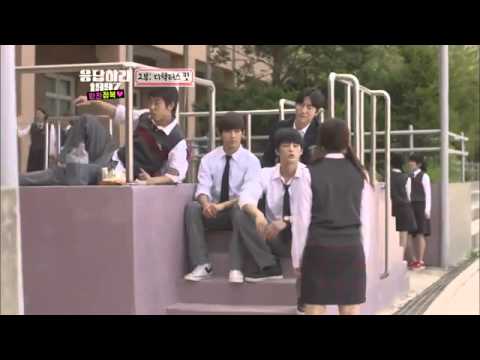
Image resolution: width=480 pixels, height=360 pixels. Find the location of `window panes`. window panes is located at coordinates (66, 88), (49, 88), (49, 113), (66, 107).